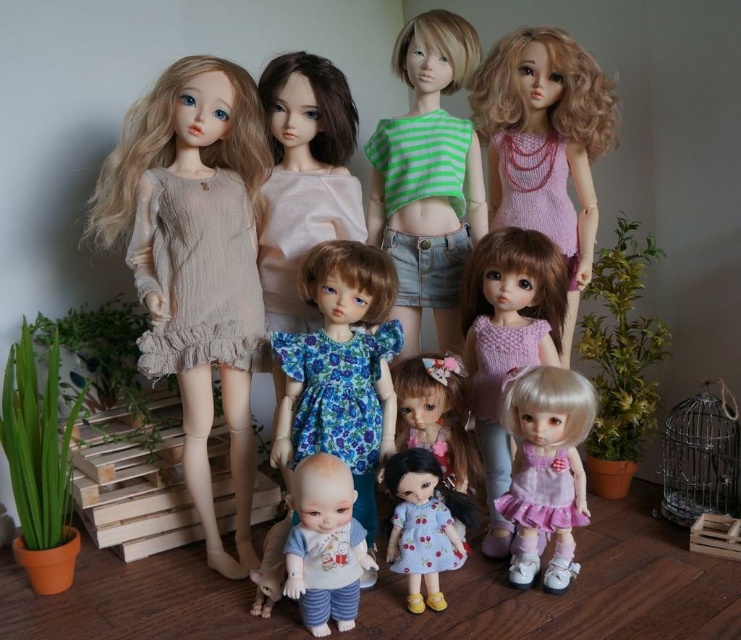
Question: Is matte beige dress at left further to the viewer compared to green striped fabric top at upper center?

Choices:
 (A) no
 (B) yes

Answer: (A)

Question: Estimate the real-world distances between objects in this image. Which object is closer to the matte blue dress at center?

Choices:
 (A) blue floral dress at center
 (B) pink knitted dress at center
 (C) pastel pink fabric dress at lower right
 (D) matte beige dress at upper left

Answer: (A)

Question: Considering the relative positions of pink knitted dress at upper right and matte pink dress at center in the image provided, where is pink knitted dress at upper right located with respect to matte pink dress at center?

Choices:
 (A) left
 (B) right

Answer: (B)

Question: In this image, where is green striped fabric top at upper center located relative to blue floral dress at center?

Choices:
 (A) above
 (B) below

Answer: (A)

Question: Among these points, which one is farthest from the camera?

Choices:
 (A) (259, 84)
 (B) (382, 154)

Answer: (B)

Question: Which point is farther from the camera taking this photo?

Choices:
 (A) (388, 460)
 (B) (485, 106)

Answer: (B)